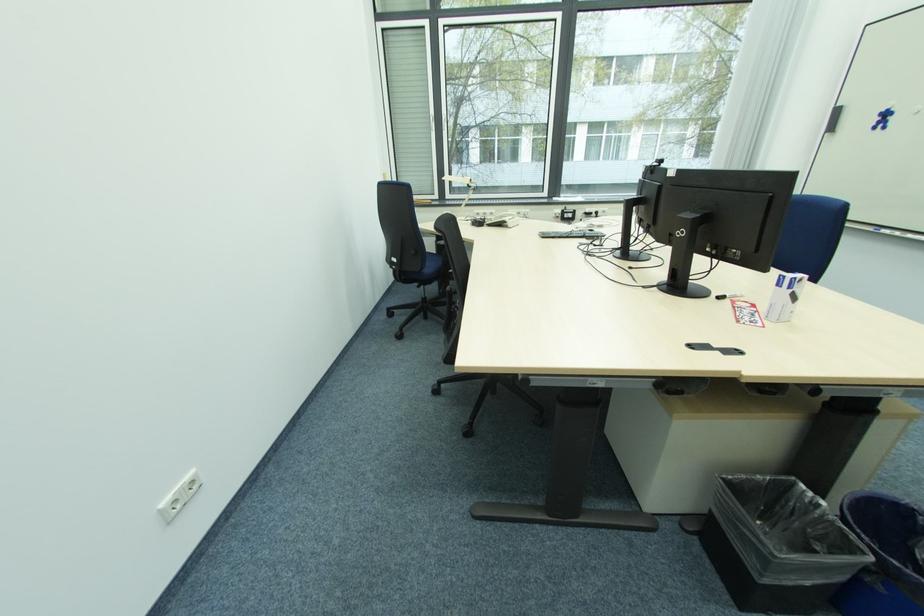
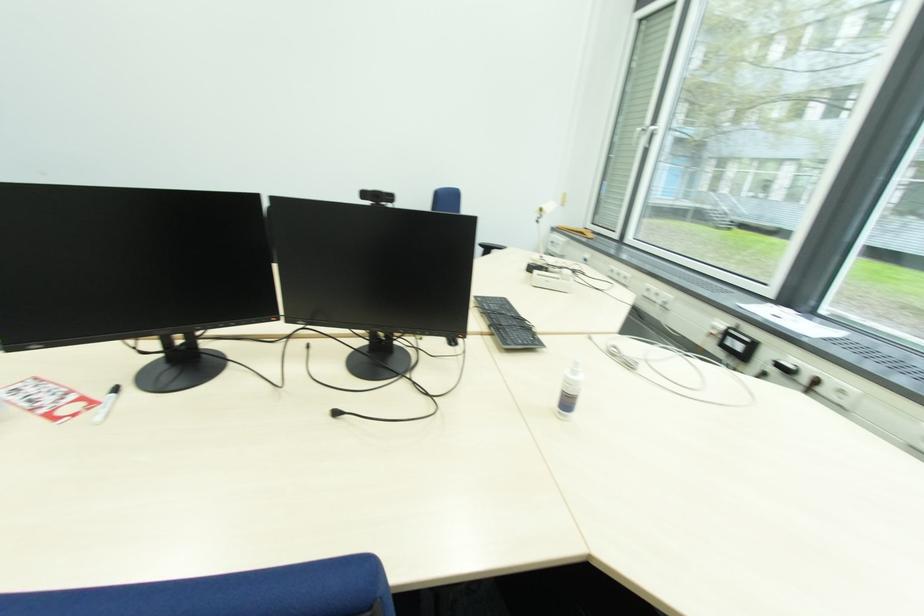
Find the pixel in the second image that matches point (723, 300) in the first image.

(118, 392)